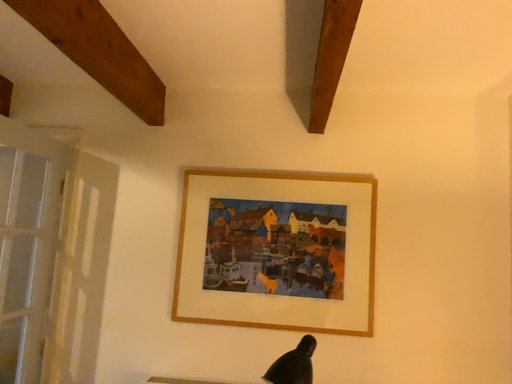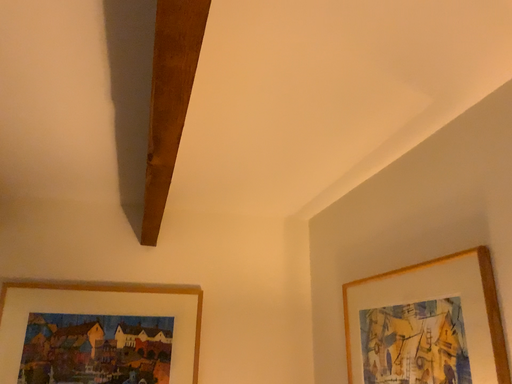
Question: Which way did the camera rotate in the video?

Choices:
 (A) rotated right
 (B) rotated left

Answer: (A)